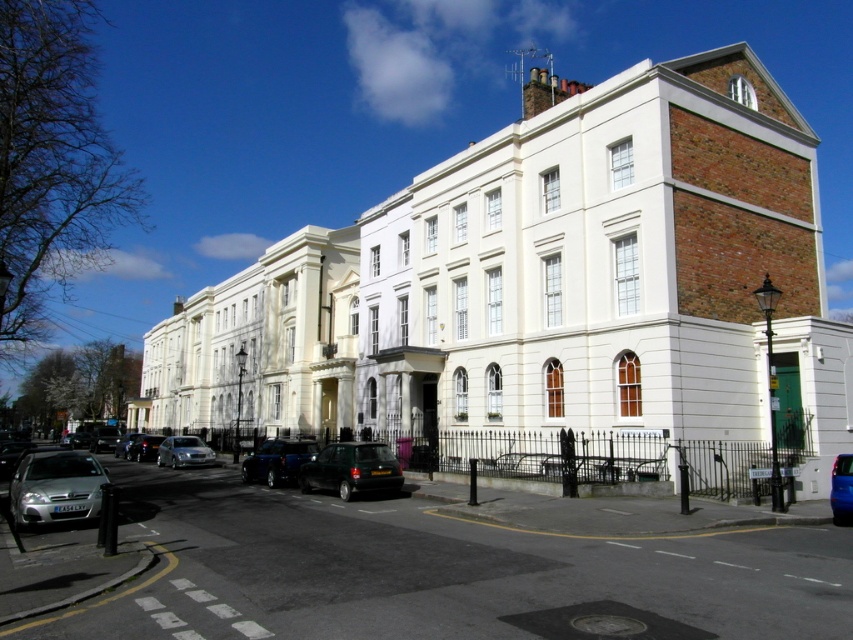
Is dark green matte car at center thinner than shiny blue car at center?

Indeed, dark green matte car at center has a lesser width compared to shiny blue car at center.

Based on the photo, is dark green matte car at center behind shiny blue car at center?

Yes, dark green matte car at center is behind shiny blue car at center.

Is point (363, 483) more distant than point (840, 490)?

Yes, it is behind point (840, 490).

At what (x,y) coordinates should I click in order to perform the action: click on dark green matte car at center. Please return your answer as a coordinate pair (x, y). The width and height of the screenshot is (853, 640). Looking at the image, I should click on (351, 468).

Is point (844, 476) behind point (119, 451)?

No, it is not.

What do you see at coordinates (840, 488) in the screenshot? The width and height of the screenshot is (853, 640). I see `shiny blue car at center` at bounding box center [840, 488].

What do you see at coordinates (840, 488) in the screenshot? This screenshot has height=640, width=853. I see `shiny blue car at center` at bounding box center [840, 488].

In order to click on shiny blue car at center in this screenshot , I will do `click(840, 488)`.

Which is below, silver metallic car at lower left or shiny silver car at lower left?

shiny silver car at lower left is below.

Which is in front, point (77, 492) or point (119, 444)?

Point (77, 492) is in front.

Identify the location of silver metallic car at lower left. The width and height of the screenshot is (853, 640). (55, 486).